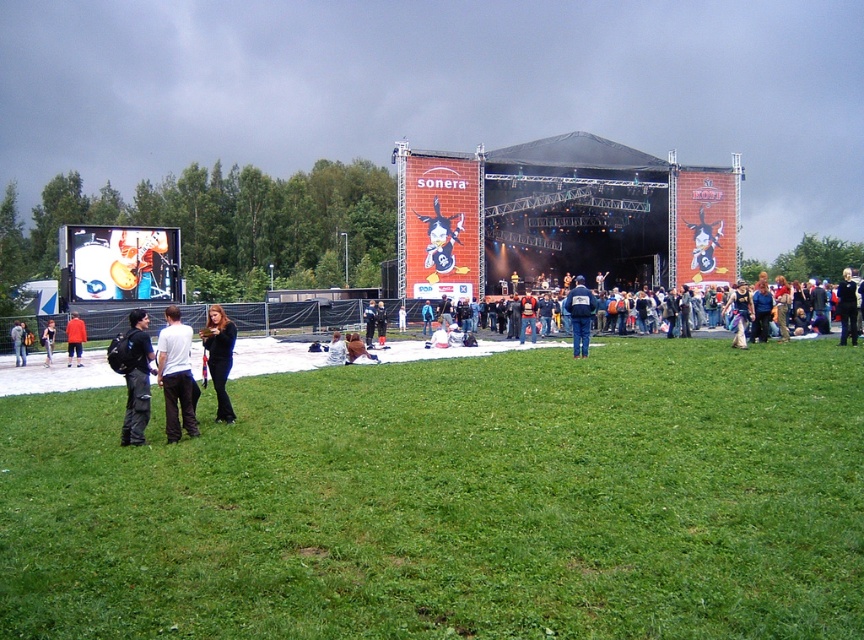
You are a photographer at the music festival and want to capture a photo of the stage with the black leather jacket at lower left in the frame. Based on its coordinates, where should you position the jacket in your camera viewfinder?

The black leather jacket at lower left is located at coordinates point (x=219, y=356), so position it at that point in your camera viewfinder to include it in the photo.

You are a photographer at the music festival and want to capture a photo of the brown leather jacket at center. The stage is located at the back. Where should you position yourself to ensure the jacket is in the foreground while the stage remains visible in the background?

Position yourself between the brown leather jacket at center and the stage so that the jacket is in the foreground and the stage is visible in the background.